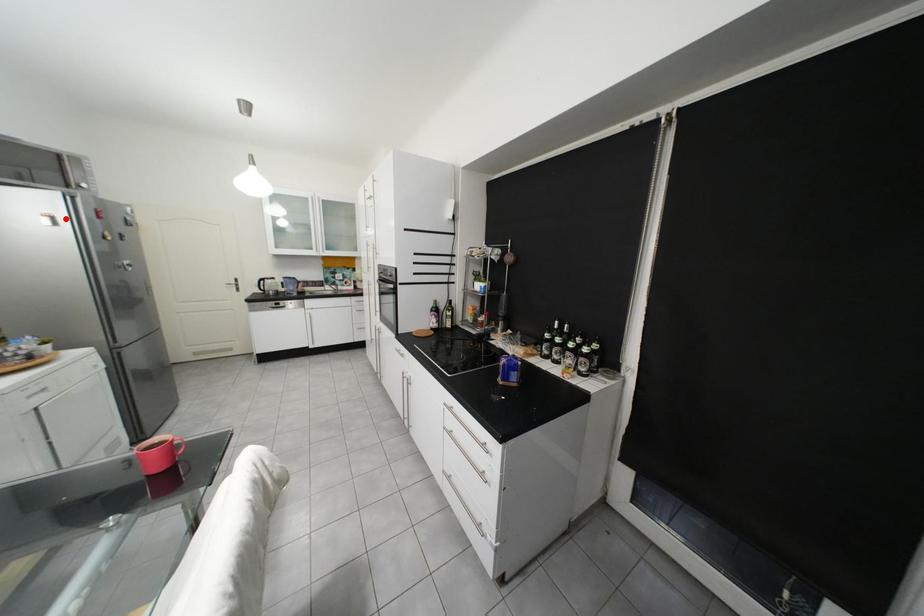
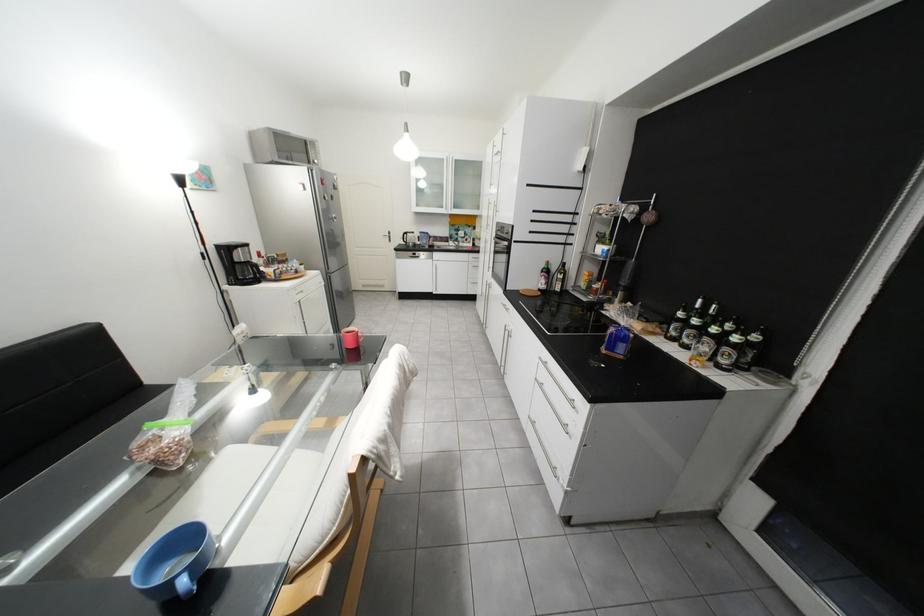
Question: I am providing you with two images of the same scene from different viewpoints. Image1 has a red point marked. In image2, the corresponding 3D location appears at what relative position? Reply with the corresponding letter.

Choices:
 (A) Closer
 (B) Farther

Answer: (A)